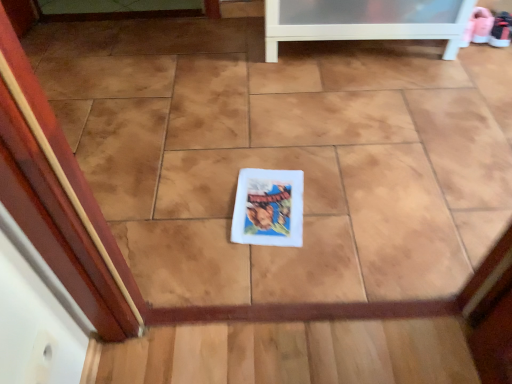
This screenshot has height=384, width=512. Describe the element at coordinates (268, 208) in the screenshot. I see `white matte book cover at center` at that location.

What is the approximate width of white matte book cover at center?

The width of white matte book cover at center is 12.80 inches.

Find the location of a particular element. Image resolution: width=512 pixels, height=384 pixels. white matte book cover at center is located at coordinates click(x=268, y=208).

You are a GUI agent. You are given a task and a screenshot of the screen. Output one action in this format:
    pyautogui.click(x=<x>, y=<y>)
    Task: Click on the white matte book cover at center
    The image size is (512, 384).
    Given the screenshot: What is the action you would take?
    (x=268, y=208)